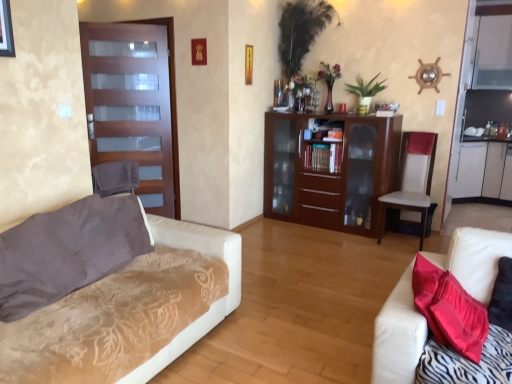
Find the location of a particular element. free space below white leather chair at right (from a real-world perspective) is located at coordinates (402, 240).